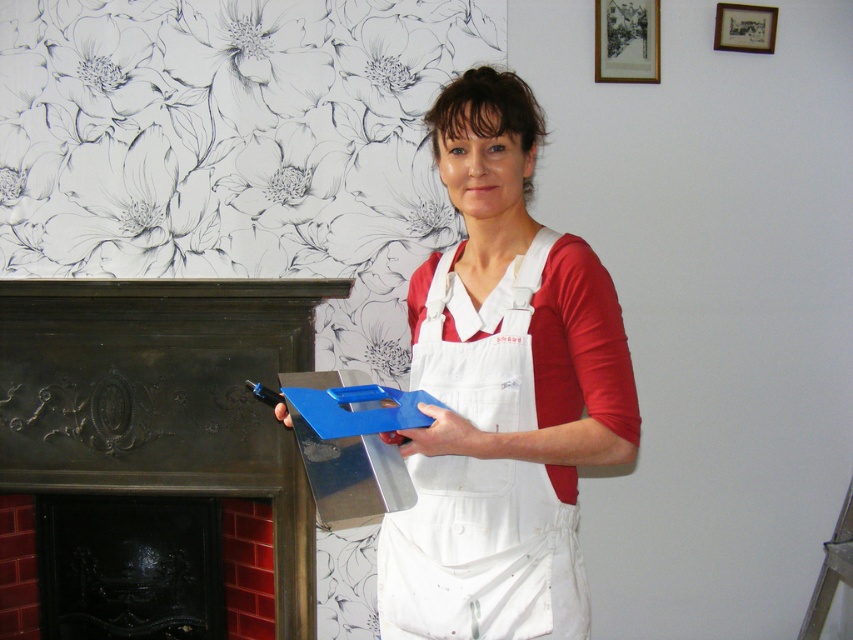
The height and width of the screenshot is (640, 853). What do you see at coordinates (502, 392) in the screenshot? I see `white cotton apron at center` at bounding box center [502, 392].

Is point (471, 426) positioned in front of point (415, 422)?

No, (471, 426) is behind (415, 422).

Identify the location of white cotton apron at center. (502, 392).

Between point (456, 342) and point (293, 529), which one is positioned behind?

Point (293, 529)

Describe the element at coordinates (502, 392) in the screenshot. I see `white cotton apron at center` at that location.

Which is behind, point (595, 412) or point (325, 289)?

The point (325, 289) is behind.

Identify the location of white cotton apron at center. (502, 392).

Between point (80, 436) and point (387, 394), which one is positioned in front?

Positioned in front is point (387, 394).

Between dark brown polished wood fireplace at left and blue plastic trowel at center, which one appears on the left side from the viewer's perspective?

dark brown polished wood fireplace at left

Between point (20, 388) and point (335, 419), which one is positioned in front?

Point (335, 419) is more forward.

Image resolution: width=853 pixels, height=640 pixels. In order to click on dark brown polished wood fireplace at left in this screenshot , I will do pyautogui.click(x=163, y=400).